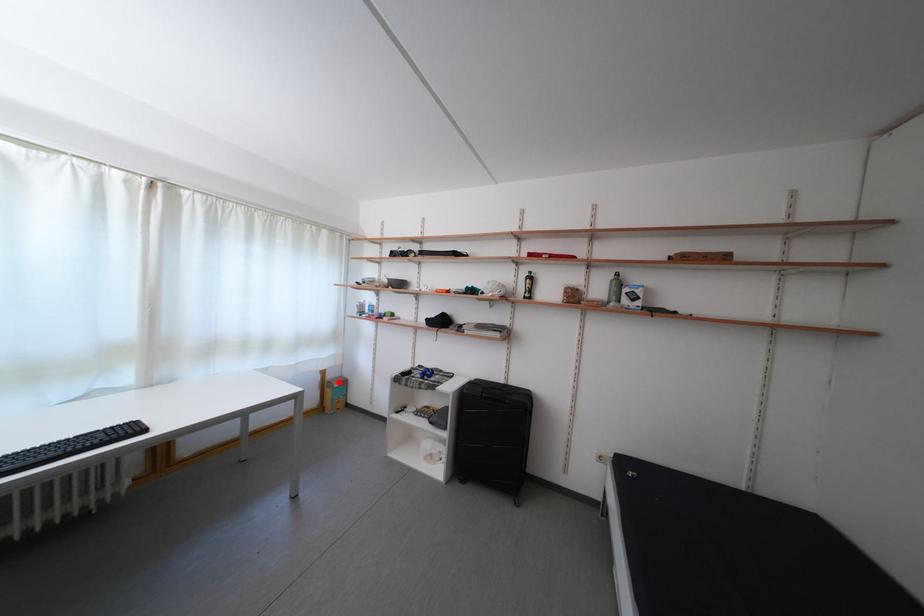
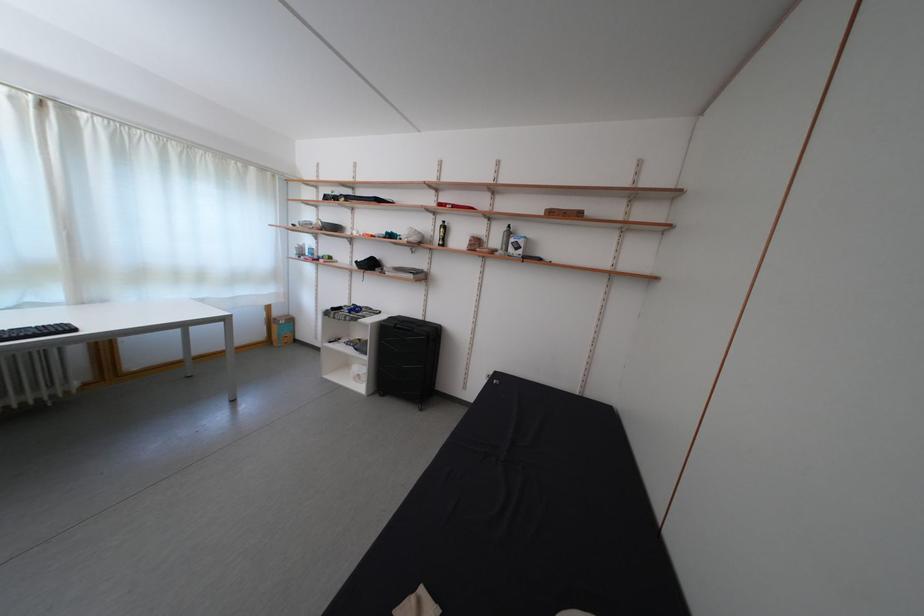
In the second image, find the point that corresponds to the highlighted location in the first image.

(285, 320)